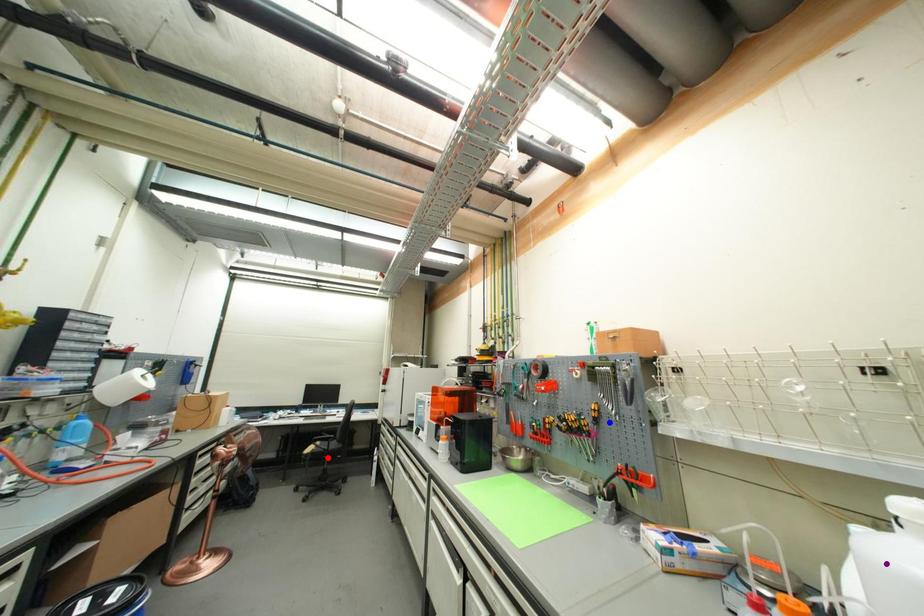
Order these from farthest to nearest:
- red point
- purple point
- blue point

red point < blue point < purple point